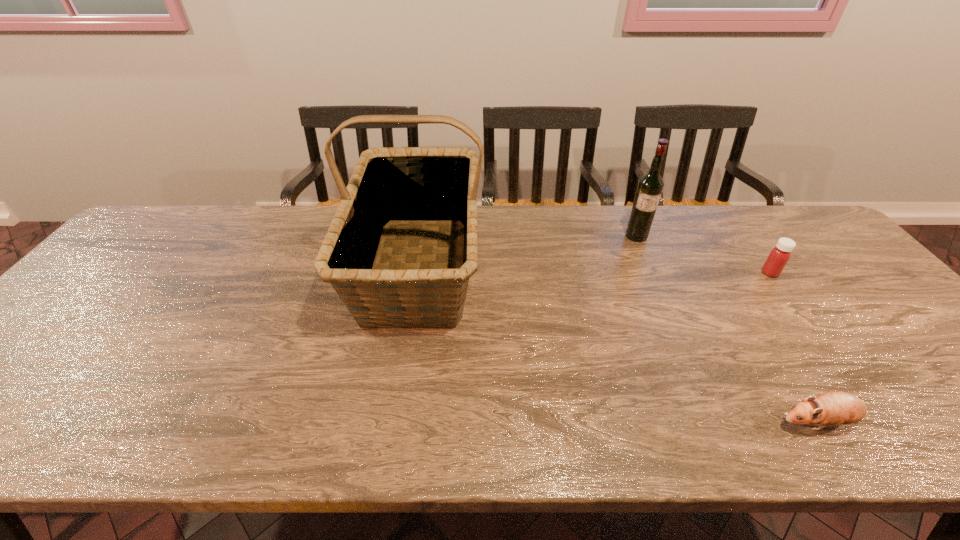
Identify the location of the tallest object. This screenshot has width=960, height=540. (430, 186).

This screenshot has width=960, height=540. Find the location of `the leftmost object`. the leftmost object is located at coordinates (430, 186).

Locate an element on the screen. the third shortest object is located at coordinates (650, 186).

At what (x,y) coordinates should I click in order to perform the action: click on the third object from right to left. Please return your answer as a coordinate pair (x, y). This screenshot has height=540, width=960. Looking at the image, I should click on (650, 186).

Identify the location of medicine. This screenshot has height=540, width=960. (779, 256).

At what (x,y) coordinates should I click in order to perform the action: click on the third tallest object. Please return your answer as a coordinate pair (x, y). Looking at the image, I should click on (779, 256).

Locate an element on the screen. the shortest object is located at coordinates (833, 408).

At what (x,y) coordinates should I click in order to perform the action: click on the nearest object. Please return your answer as a coordinate pair (x, y). This screenshot has height=540, width=960. Looking at the image, I should click on (833, 408).

Locate an element on the screen. Image resolution: width=960 pixels, height=540 pixels. free space located by the handle of the basket is located at coordinates (398, 390).

Where is `vacant space located on the front and back of the third object from right to left`? vacant space located on the front and back of the third object from right to left is located at coordinates (656, 281).